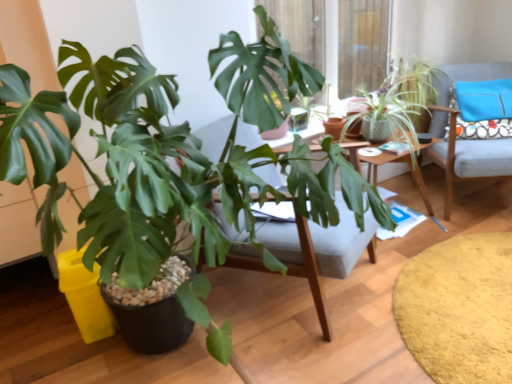
Question: Should I look upward or downward to see wooden desk at center?

Choices:
 (A) up
 (B) down

Answer: (A)

Question: Is soft yellow rug at lower right facing towards light gray fabric chair at right?

Choices:
 (A) yes
 (B) no

Answer: (B)

Question: Is light gray fabric chair at right completely or partially inside soft yellow rug at lower right?

Choices:
 (A) yes
 (B) no

Answer: (B)

Question: Is soft yellow rug at lower right not inside light gray fabric chair at right?

Choices:
 (A) yes
 (B) no

Answer: (A)

Question: Is soft yellow rug at lower right thinner than light gray fabric chair at right?

Choices:
 (A) no
 (B) yes

Answer: (A)

Question: Is soft yellow rug at lower right at the right side of light gray fabric chair at right?

Choices:
 (A) no
 (B) yes

Answer: (A)

Question: Can you confirm if soft yellow rug at lower right is positioned to the left of light gray fabric chair at right?

Choices:
 (A) no
 (B) yes

Answer: (B)

Question: Is green textured plant at upper right, positioned as the 1th houseplant in right-to-left order, closer to camera compared to wooden swivel chair at center?

Choices:
 (A) no
 (B) yes

Answer: (A)

Question: From a real-world perspective, is green textured plant at upper right, placed as the second houseplant when sorted from left to right, below wooden swivel chair at center?

Choices:
 (A) yes
 (B) no

Answer: (B)

Question: Can you confirm if green textured plant at upper right, placed as the second houseplant when sorted from left to right, is positioned to the left of wooden swivel chair at center?

Choices:
 (A) yes
 (B) no

Answer: (B)

Question: Can you confirm if green textured plant at upper right, the second houseplant from the front, is smaller than wooden swivel chair at center?

Choices:
 (A) no
 (B) yes

Answer: (B)

Question: Considering the relative sizes of green textured plant at upper right, placed as the second houseplant when sorted from left to right, and wooden swivel chair at center in the image provided, is green textured plant at upper right, placed as the second houseplant when sorted from left to right, taller than wooden swivel chair at center?

Choices:
 (A) yes
 (B) no

Answer: (B)

Question: Is wooden swivel chair at center in contact with green matte plant at center, which ranks as the second houseplant in back-to-front order?

Choices:
 (A) no
 (B) yes

Answer: (A)